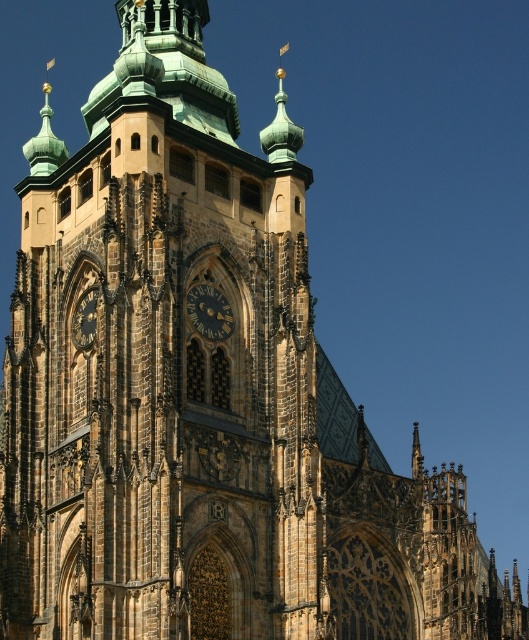
You are an architect analyzing the Gothic tower. You observe the dark brown stone clock at center and the gold metallic clock at center. Which clock has a smaller height?

The dark brown stone clock at center is not as tall as the gold metallic clock at center, so the dark brown stone clock at center has a smaller height.

You are standing in front of the Gothic church tower and see a point marked at coordinates (209,310). Based on the scene description, can you identify which architectural feature this point is located on?

The point at coordinates (209,310) is located on the dark brown stone clock at center.